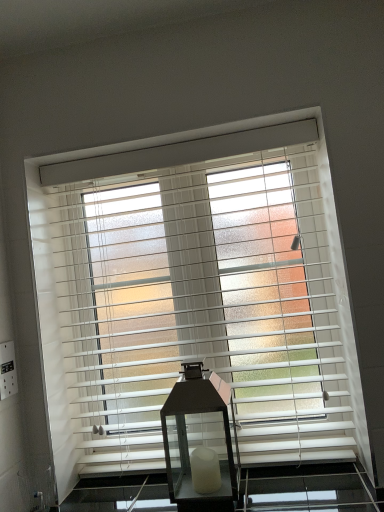
Question: Can you confirm if white matte blinds at center is taller than matte black lantern at center?

Choices:
 (A) yes
 (B) no

Answer: (A)

Question: From a real-world perspective, is white matte blinds at center positioned under matte black lantern at center based on gravity?

Choices:
 (A) yes
 (B) no

Answer: (B)

Question: Does white matte blinds at center have a greater width compared to matte black lantern at center?

Choices:
 (A) no
 (B) yes

Answer: (A)

Question: Does white matte blinds at center contain matte black lantern at center?

Choices:
 (A) no
 (B) yes

Answer: (A)

Question: From the image's perspective, is white matte blinds at center below matte black lantern at center?

Choices:
 (A) yes
 (B) no

Answer: (B)

Question: Is white matte blinds at center behind matte black lantern at center?

Choices:
 (A) no
 (B) yes

Answer: (B)

Question: Is white matte blinds at center surrounded by matte black lantern at center?

Choices:
 (A) yes
 (B) no

Answer: (B)

Question: Is matte black lantern at center wider than white matte blinds at center?

Choices:
 (A) no
 (B) yes

Answer: (B)

Question: Considering the relative positions of matte black lantern at center and white matte blinds at center in the image provided, is matte black lantern at center to the left of white matte blinds at center from the viewer's perspective?

Choices:
 (A) yes
 (B) no

Answer: (B)

Question: Does matte black lantern at center turn towards white matte blinds at center?

Choices:
 (A) yes
 (B) no

Answer: (B)

Question: Considering the relative sizes of matte black lantern at center and white matte blinds at center in the image provided, is matte black lantern at center thinner than white matte blinds at center?

Choices:
 (A) yes
 (B) no

Answer: (B)

Question: Is the depth of matte black lantern at center less than that of white matte blinds at center?

Choices:
 (A) yes
 (B) no

Answer: (A)

Question: Visually, is matte black lantern at center positioned to the left or to the right of white matte blinds at center?

Choices:
 (A) right
 (B) left

Answer: (A)